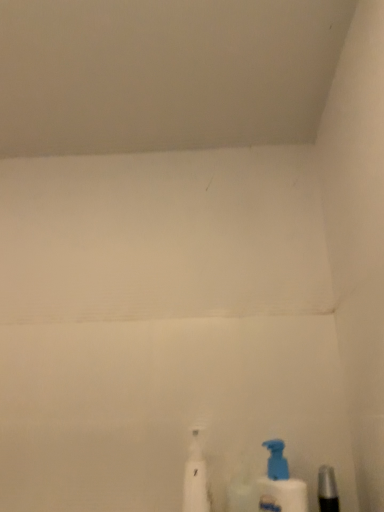
Question: From a real-world perspective, is metallic silver razor at lower right physically below blue plastic bottle at lower right?

Choices:
 (A) no
 (B) yes

Answer: (B)

Question: Is metallic silver razor at lower right wider than blue plastic bottle at lower right?

Choices:
 (A) yes
 (B) no

Answer: (B)

Question: Can you confirm if metallic silver razor at lower right is positioned to the left of blue plastic bottle at lower right?

Choices:
 (A) no
 (B) yes

Answer: (A)

Question: From a real-world perspective, is metallic silver razor at lower right on blue plastic bottle at lower right?

Choices:
 (A) no
 (B) yes

Answer: (A)

Question: Is metallic silver razor at lower right thinner than blue plastic bottle at lower right?

Choices:
 (A) no
 (B) yes

Answer: (B)

Question: Considering the positions of blue plastic bottle at lower right and metallic silver razor at lower right in the image, is blue plastic bottle at lower right wider or thinner than metallic silver razor at lower right?

Choices:
 (A) wide
 (B) thin

Answer: (A)

Question: Based on their sizes in the image, would you say blue plastic bottle at lower right is bigger or smaller than metallic silver razor at lower right?

Choices:
 (A) small
 (B) big

Answer: (B)

Question: In the image, is blue plastic bottle at lower right positioned in front of or behind metallic silver razor at lower right?

Choices:
 (A) behind
 (B) front

Answer: (A)

Question: In terms of height, does blue plastic bottle at lower right look taller or shorter compared to metallic silver razor at lower right?

Choices:
 (A) tall
 (B) short

Answer: (A)

Question: Is white plastic spray bottle at lower center in front of or behind metallic silver razor at lower right in the image?

Choices:
 (A) behind
 (B) front

Answer: (A)

Question: From a real-world perspective, relative to metallic silver razor at lower right, is white plastic spray bottle at lower center vertically above or below?

Choices:
 (A) below
 (B) above

Answer: (B)

Question: Considering the positions of white plastic spray bottle at lower center and metallic silver razor at lower right in the image, is white plastic spray bottle at lower center wider or thinner than metallic silver razor at lower right?

Choices:
 (A) wide
 (B) thin

Answer: (A)

Question: Based on their sizes in the image, would you say white plastic spray bottle at lower center is bigger or smaller than metallic silver razor at lower right?

Choices:
 (A) small
 (B) big

Answer: (B)

Question: From the image's perspective, is blue plastic bottle at lower right located above or below white plastic spray bottle at lower center?

Choices:
 (A) above
 (B) below

Answer: (B)

Question: Is blue plastic bottle at lower right wider or thinner than white plastic spray bottle at lower center?

Choices:
 (A) thin
 (B) wide

Answer: (A)